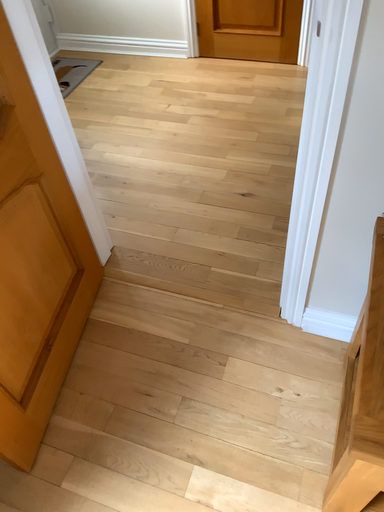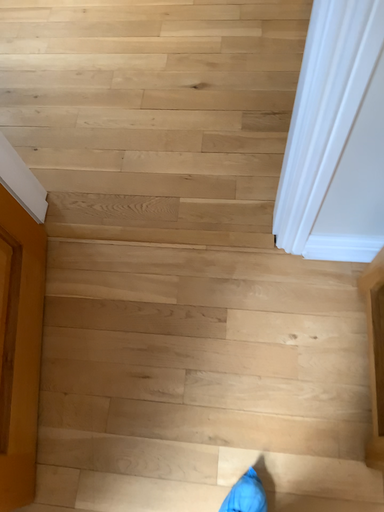
Question: Which way did the camera rotate in the video?

Choices:
 (A) rotated downward
 (B) rotated upward

Answer: (A)